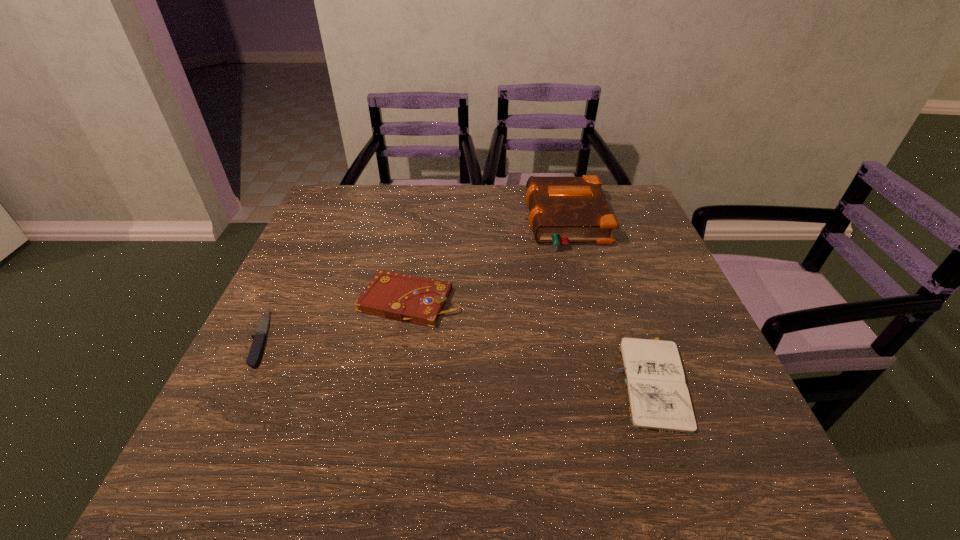
Where is `blank space at the left edge`? The image size is (960, 540). blank space at the left edge is located at coordinates (318, 330).

In the image, there is a desktop. Where is `vacant area at the right edge`? vacant area at the right edge is located at coordinates (655, 306).

In the image, there is a desktop. At what (x,y) coordinates should I click in order to perform the action: click on vacant space at the far left corner. Please return your answer as a coordinate pair (x, y). The image size is (960, 540). Looking at the image, I should click on (354, 200).

This screenshot has height=540, width=960. In the image, there is a desktop. In order to click on vacant space at the near left corner in this screenshot , I will do `click(183, 495)`.

The image size is (960, 540). I want to click on vacant space at the near right corner of the desktop, so click(774, 480).

Find the location of a particular element. The height and width of the screenshot is (540, 960). free spot between the second shortest object and the taller notebook is located at coordinates (531, 341).

Find the location of a particular element. This screenshot has width=960, height=540. vacant space in between the second object from left to right and the right notebook is located at coordinates [531, 341].

Identify the location of free space between the nearer notebook and the tallest object. (610, 301).

At what (x,y) coordinates should I click in order to perform the action: click on vacant space that is in between the third shortest object and the shorter notebook. Please return your answer as a coordinate pair (x, y). Image resolution: width=960 pixels, height=540 pixels. Looking at the image, I should click on (531, 341).

Find the location of a particular element. free space between the second object from left to right and the farthest object is located at coordinates (x=488, y=261).